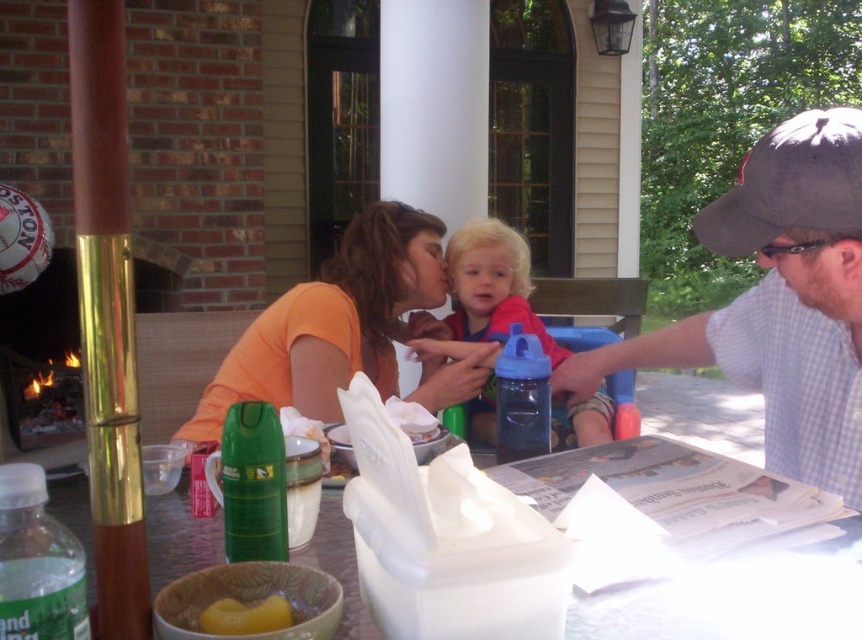
You are organizing a picnic and need to know which item is narrower between the orange matte shirt at center and the translucent plastic table at center. Which one is narrower?

The orange matte shirt at center is narrower than the translucent plastic table at center.

You are sitting at the translucent plastic table at center and want to reach the red fabric shirt at center. Can you easily access it without moving your seat?

The translucent plastic table at center is below the red fabric shirt at center, so you can easily reach it without moving your seat.

You are standing at the edge of the table and want to pick up the orange matte shirt at center and the translucent plastic table at center. Which object can you reach without moving your current position?

The orange matte shirt at center is closer to you than the translucent plastic table at center, so you can reach the orange matte shirt at center without moving.